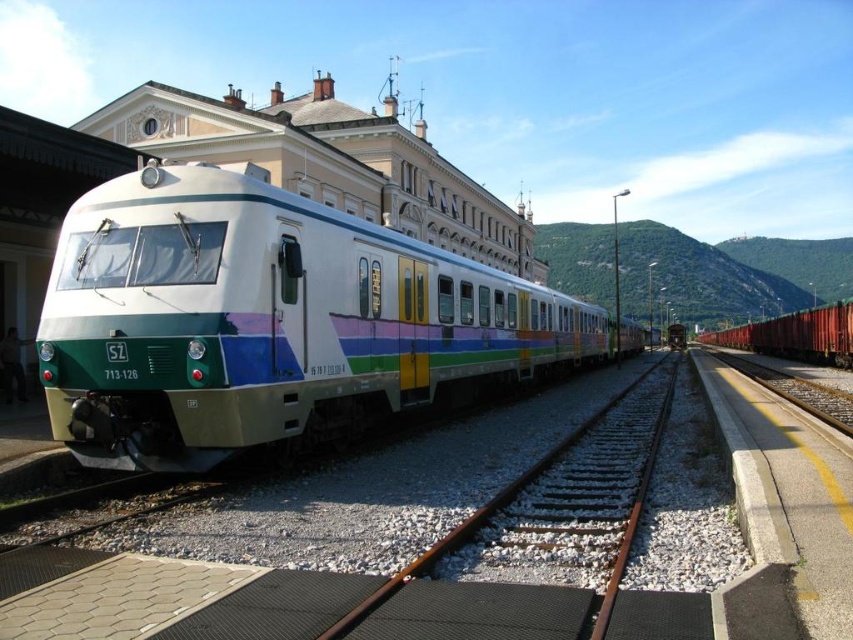
Question: In this image, where is white glossy passenger train at center located relative to red matte freight car at right?

Choices:
 (A) left
 (B) right

Answer: (A)

Question: Is white glossy passenger train at center above brown metal train track at center?

Choices:
 (A) no
 (B) yes

Answer: (B)

Question: Is white glossy passenger train at center smaller than brown metal train track at center?

Choices:
 (A) yes
 (B) no

Answer: (B)

Question: Which is nearer to the white glossy passenger train at center?

Choices:
 (A) red matte freight car at right
 (B) brown metal train track at center

Answer: (B)

Question: Which is farther from the brown metal train track at center?

Choices:
 (A) white glossy passenger train at center
 (B) red matte freight car at right

Answer: (B)

Question: Which object is closer to the camera taking this photo?

Choices:
 (A) red matte freight car at right
 (B) brown metal train track at center
 (C) white glossy passenger train at center

Answer: (B)